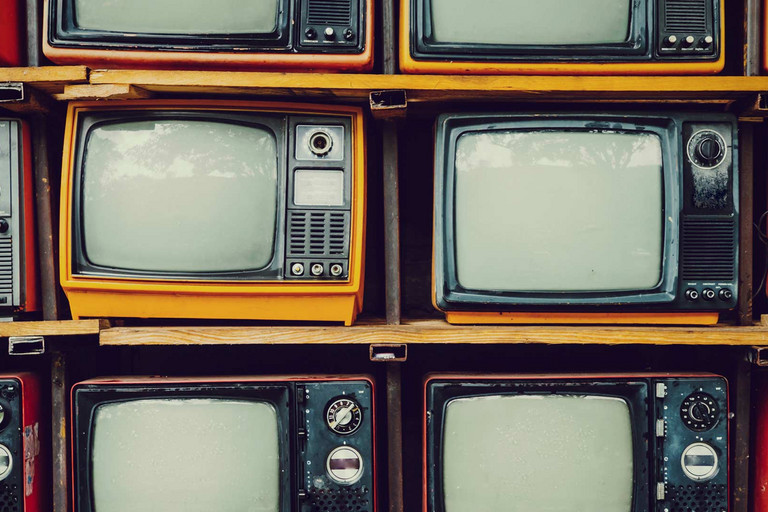
At what (x,y) coordinates should I click in order to perform the action: click on speaker for tv. Please return your answer as a coordinate pair (x, y). Looking at the image, I should click on (326, 13), (690, 16), (704, 240), (697, 498), (333, 501), (313, 240), (0, 266).